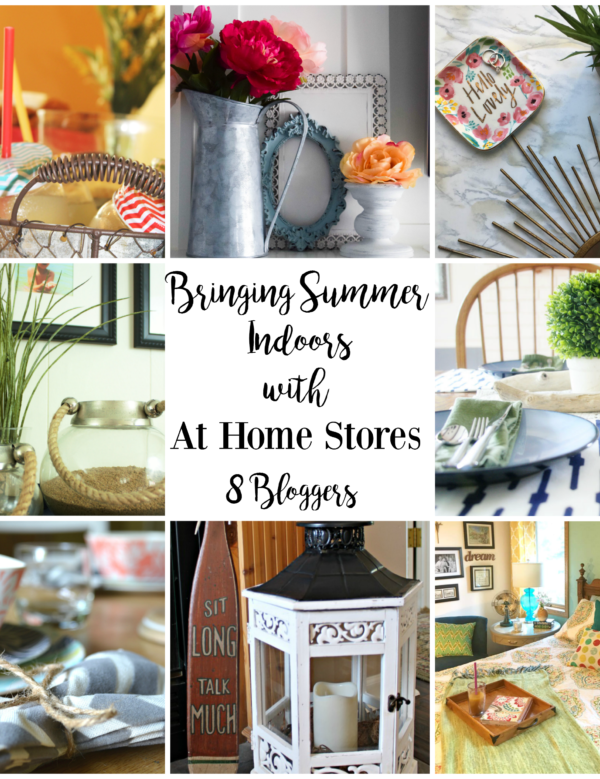
Find the location of a particular element. blue plate is located at coordinates (565, 436).